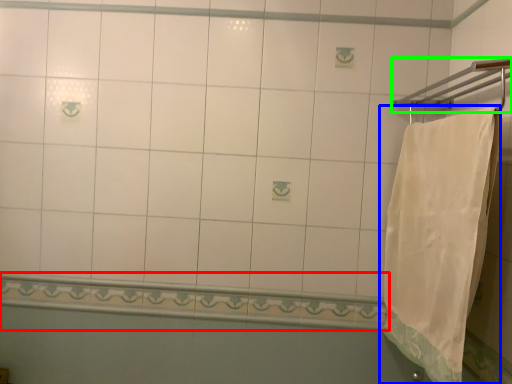
Question: Estimate the real-world distances between objects in this image. Which object is farther from balustrade (highlighted by a red box), towel (highlighted by a blue box) or towel bar (highlighted by a green box)?

Choices:
 (A) towel
 (B) towel bar

Answer: (B)